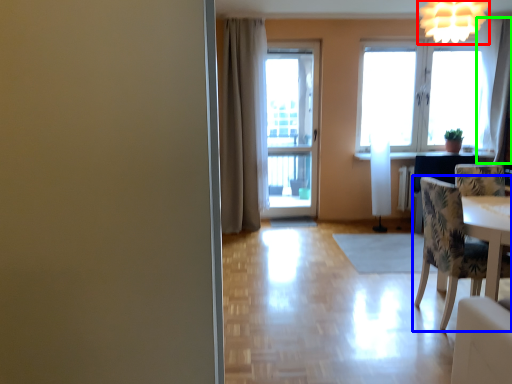
Question: Which object is the closest to the light fixture (highlighted by a red box)? Choose among these: chair (highlighted by a blue box) or curtain (highlighted by a green box).

Choices:
 (A) chair
 (B) curtain

Answer: (A)